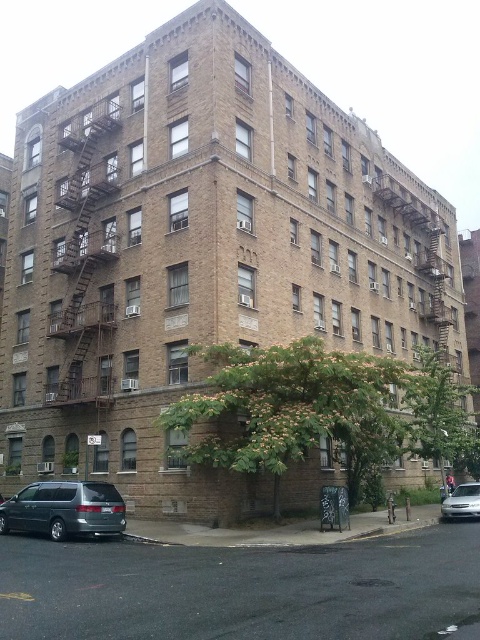
You are a delivery person trying to park your metallic gray minivan at lower left near the brown metal fire escape at left. However, there is limited space. Based on the scene, can your minivan fit in the space next to the fire escape?

The brown metal fire escape at left is larger in size than the metallic gray minivan at lower left, so the minivan should be able to fit in the space next to the fire escape since it is smaller in size.

You are a delivery person trying to park your metallic gray minivan at lower left near the brown metal fire escape at left. Can you safely park your vehicle there without blocking the fire escape?

The brown metal fire escape at left is positioned over the metallic gray minivan at lower left, which means the fire escape is above the parking spot. You can safely park the metallic gray minivan at lower left since the fire escape is located above it and not in front, so it won

You are a delivery person trying to locate the fire escape on a building. The building has a brown metal fire escape at left. Based on the coordinates provided, can you determine if the fire escape is closer to the top or bottom of the building?

The brown metal fire escape at left is positioned at coordinates point (84, 244). Since the y coordinate is 0.175, which is closer to 0 than 1, the fire escape is closer to the bottom of the building.